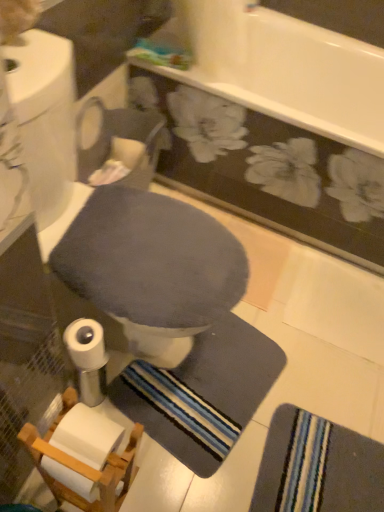
Where is `blank space above striped fabric bath towel at lower right (from a real-world perspective)`? This screenshot has height=512, width=384. blank space above striped fabric bath towel at lower right (from a real-world perspective) is located at coordinates (325, 468).